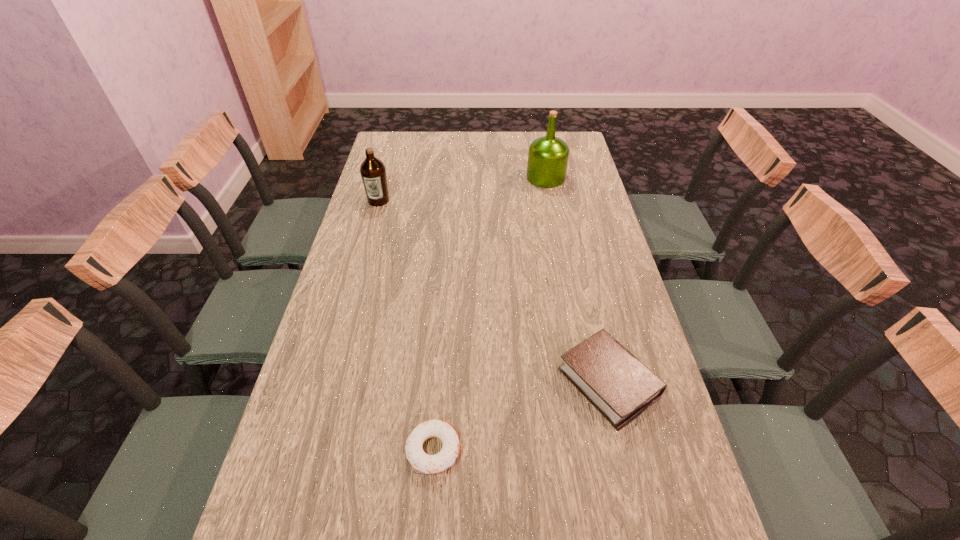
In order to click on the taller olive oil in this screenshot , I will do `click(548, 156)`.

I want to click on the tallest object, so click(x=548, y=156).

The image size is (960, 540). Find the location of `the leftmost object`. the leftmost object is located at coordinates (373, 172).

Identify the location of the second farthest object. point(373,172).

Identify the location of the third tallest object. (611, 378).

The height and width of the screenshot is (540, 960). Find the location of `doughnut`. doughnut is located at coordinates (430, 464).

You are a GUI agent. You are given a task and a screenshot of the screen. Output one action in this format:
    pyautogui.click(x=<x>, y=<y>)
    Task: Click on the third object from right to left
    
    Given the screenshot: What is the action you would take?
    [430, 464]

Where is `vacant space located on the left of the right olive oil`? vacant space located on the left of the right olive oil is located at coordinates (452, 178).

You are a GUI agent. You are given a task and a screenshot of the screen. Output one action in this format:
    pyautogui.click(x=<x>, y=<y>)
    Task: Click on the vacant point located 0.240m on the label of the second tallest object
    
    Given the screenshot: What is the action you would take?
    pyautogui.click(x=364, y=252)

Locate an element on the screen. This screenshot has height=540, width=960. free space located 0.260m on the back of the third tallest object is located at coordinates (583, 272).